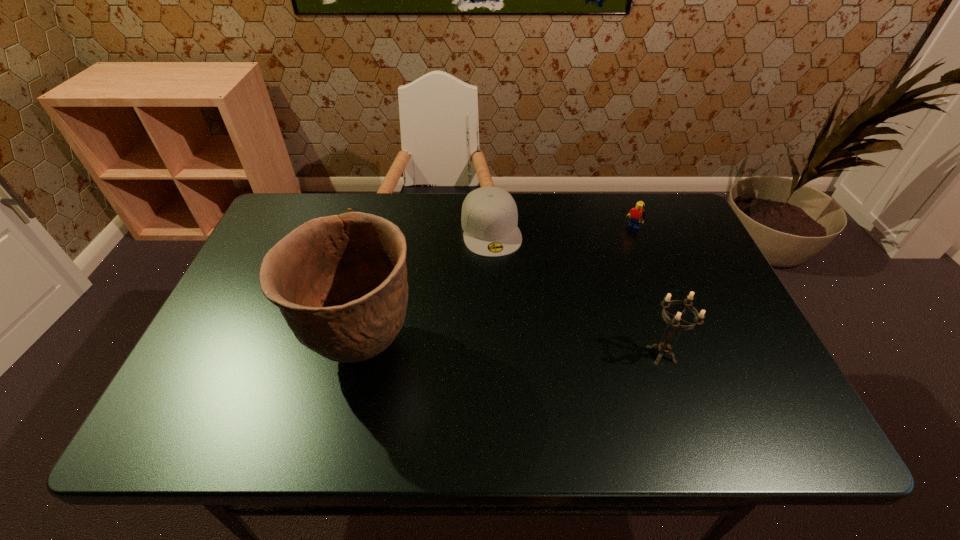
Find the location of a particular element. pottery is located at coordinates (340, 282).

Where is `the second tallest object`? The height and width of the screenshot is (540, 960). the second tallest object is located at coordinates (664, 347).

Where is `the fourth tallest object`? The width and height of the screenshot is (960, 540). the fourth tallest object is located at coordinates (489, 218).

Image resolution: width=960 pixels, height=540 pixels. In order to click on the third object from left to right in this screenshot , I will do `click(489, 218)`.

Find the location of a particular element. The image size is (960, 540). the third tallest object is located at coordinates (637, 215).

Identify the location of sunglasses. (347, 208).

You are a GUI agent. You are given a task and a screenshot of the screen. Output one action in this format:
    pyautogui.click(x=<x>, y=<y>)
    Task: Click on the vacant space located 0.110m on the back of the pottery
    
    Given the screenshot: What is the action you would take?
    pyautogui.click(x=379, y=272)

Where is `vacant space situated 0.300m on the left of the candle holder`? This screenshot has width=960, height=540. vacant space situated 0.300m on the left of the candle holder is located at coordinates (513, 354).

Find the location of a particular element. free space located on the front-facing side of the third object from left to right is located at coordinates (513, 327).

Find the location of a particular element. Image resolution: width=960 pixels, height=540 pixels. free region located on the front-facing side of the third object from left to right is located at coordinates (518, 354).